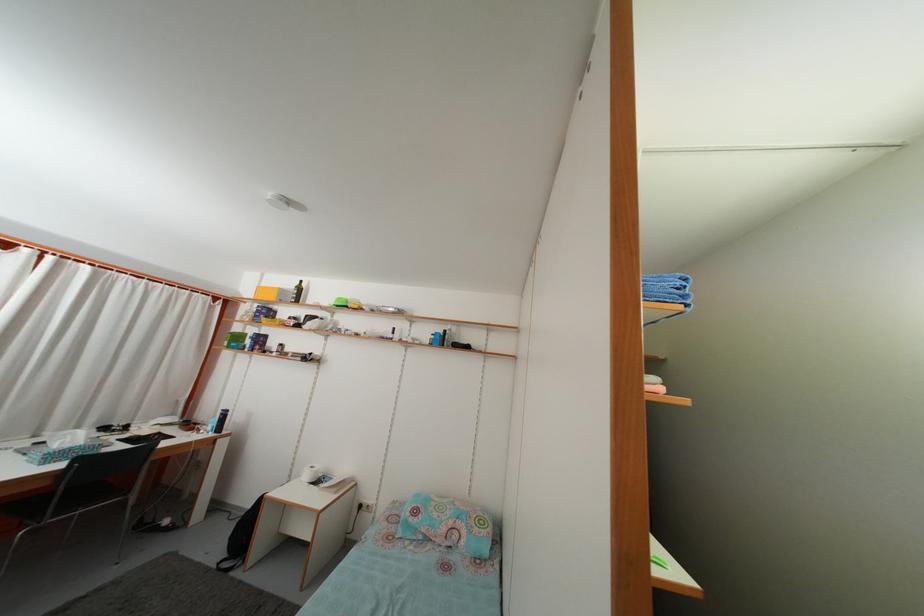
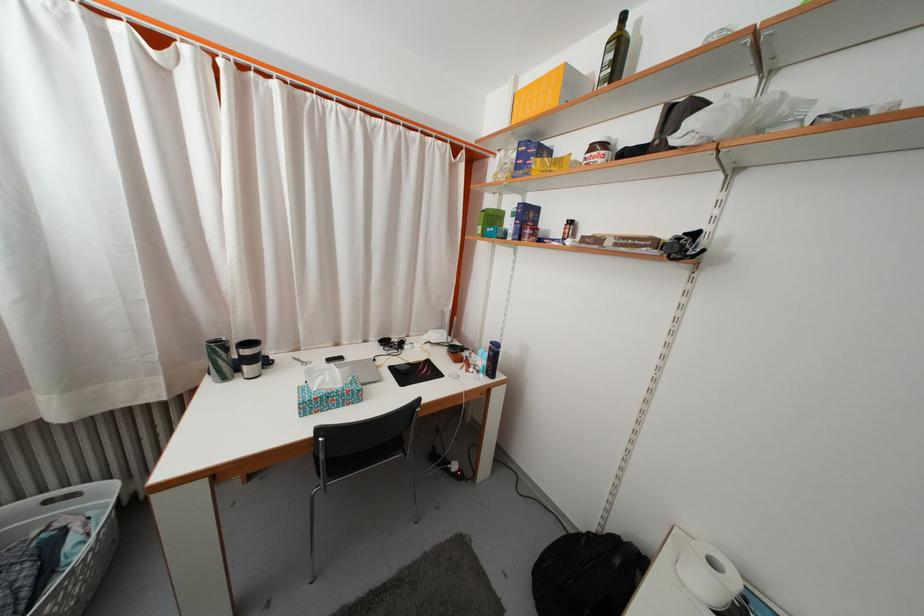
The point at (244, 345) is marked in the first image. Where is the corresponding point in the second image?

(500, 225)